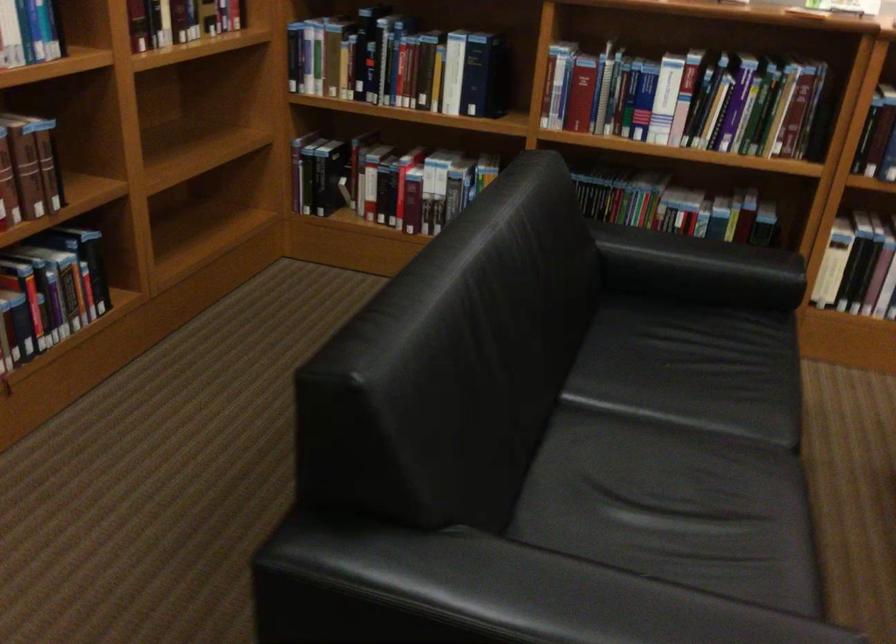
What do you see at coordinates (681, 456) in the screenshot? I see `a black sofa sitting surface` at bounding box center [681, 456].